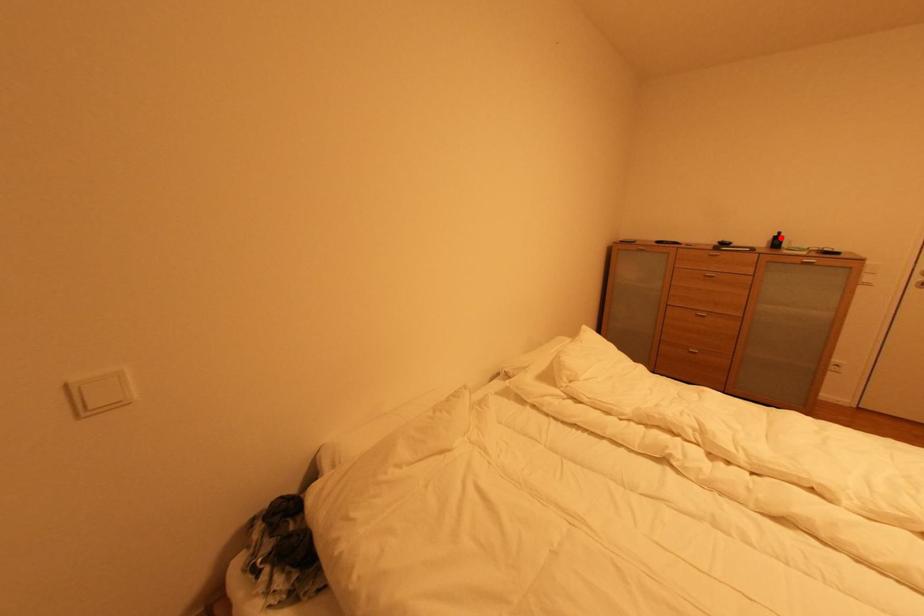
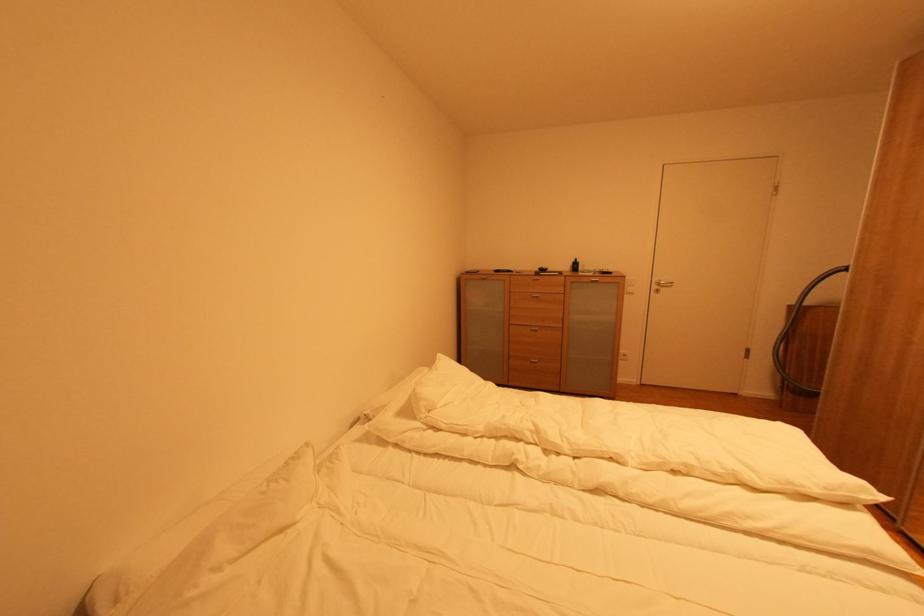
In the second image, find the point that corresponds to the highlighted location in the first image.

(578, 264)